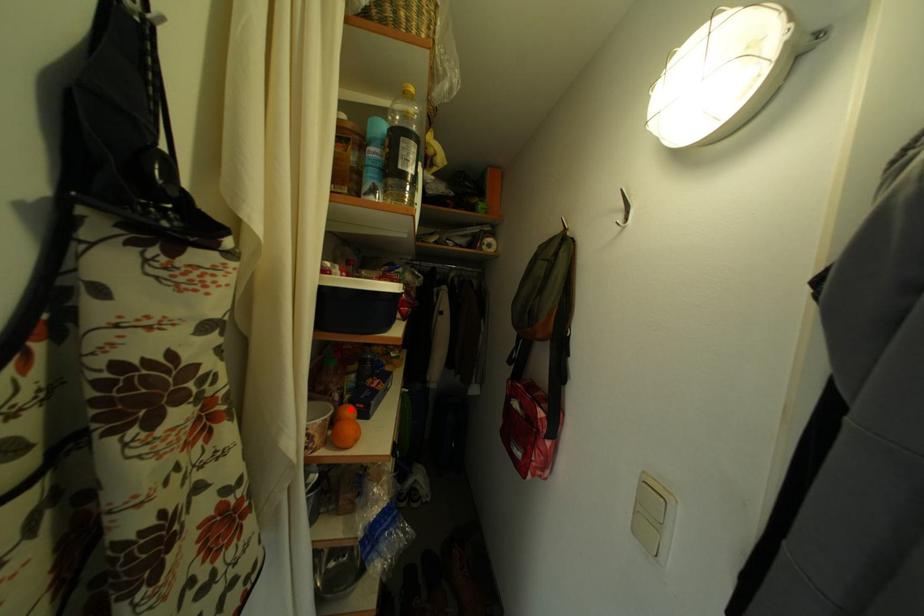
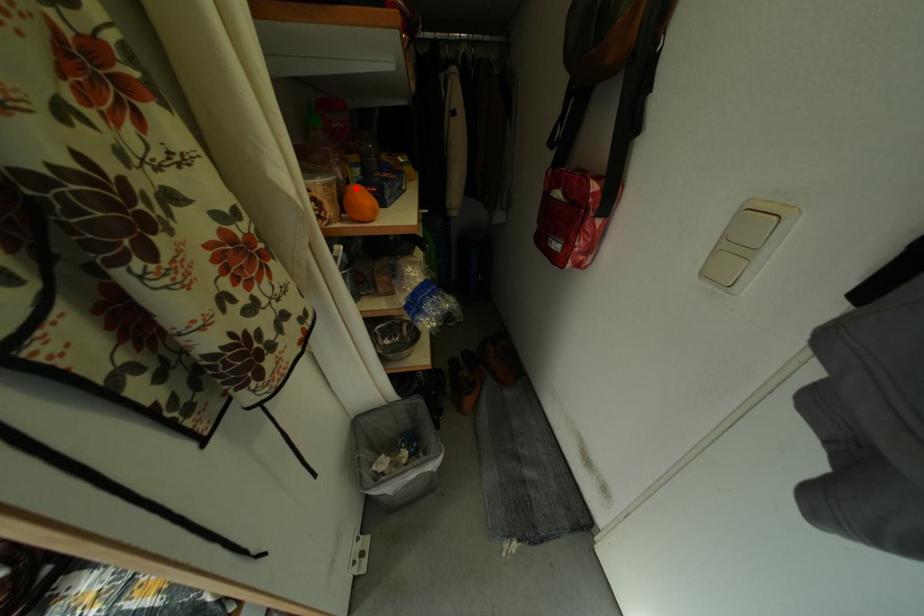
I am providing you with two images of the same scene from different viewpoints. A red point is marked on the first image and another point is marked on the second image. Is the marked point in image1 the same physical position as the marked point in image2?

Yes